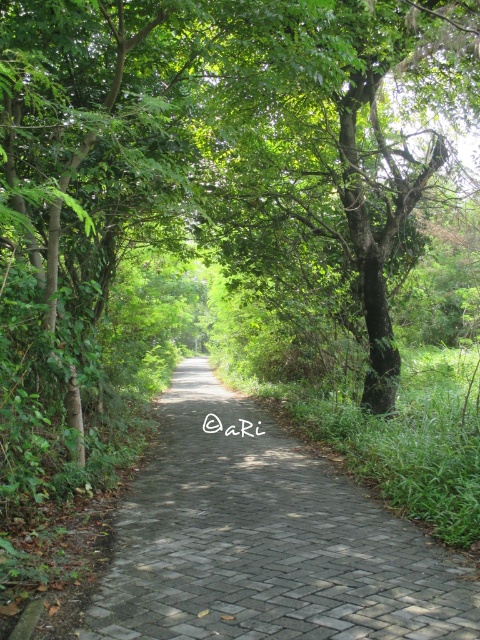
Question: Does green leafy tree at center appear on the right side of paved stone path at center?

Choices:
 (A) yes
 (B) no

Answer: (A)

Question: Among these points, which one is nearest to the camera?

Choices:
 (A) (168, 548)
 (B) (356, 38)

Answer: (A)

Question: Can you confirm if green leafy tree at center is wider than paved stone path at center?

Choices:
 (A) no
 (B) yes

Answer: (B)

Question: Is green leafy tree at center below paved stone path at center?

Choices:
 (A) yes
 (B) no

Answer: (B)